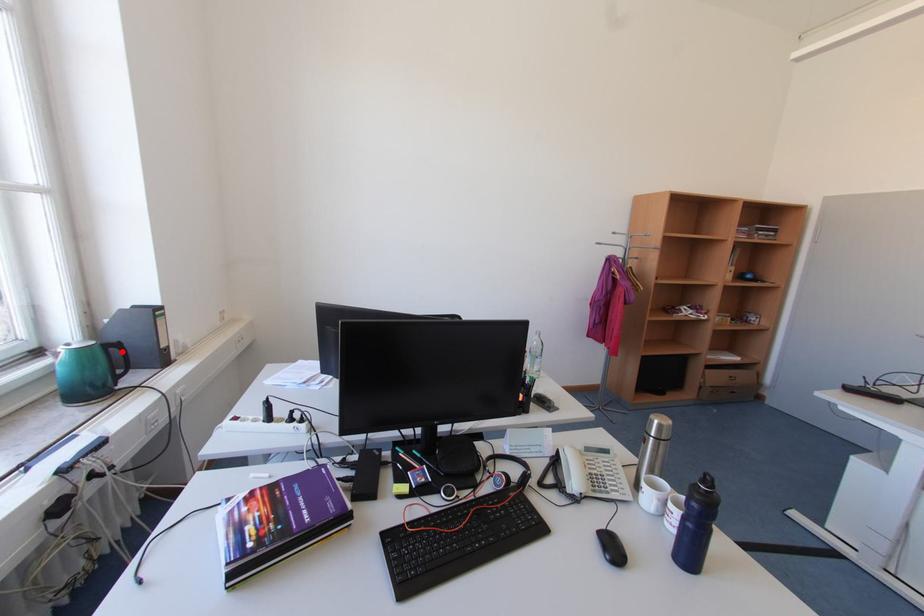
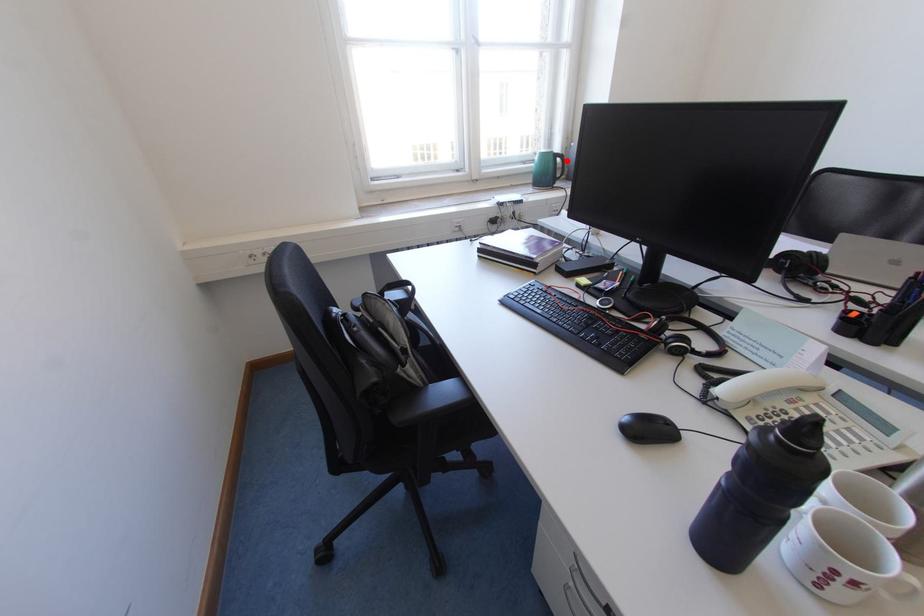
I am providing you with two images of the same scene from different viewpoints. A red point is marked on the first image and another point is marked on the second image. Is the marked point in image1 the same physical position as the marked point in image2?

Yes